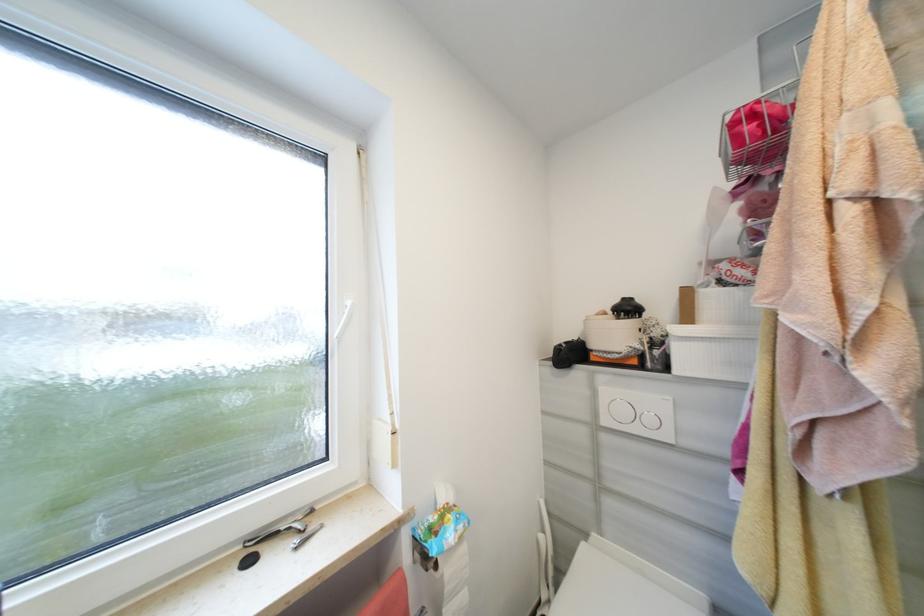
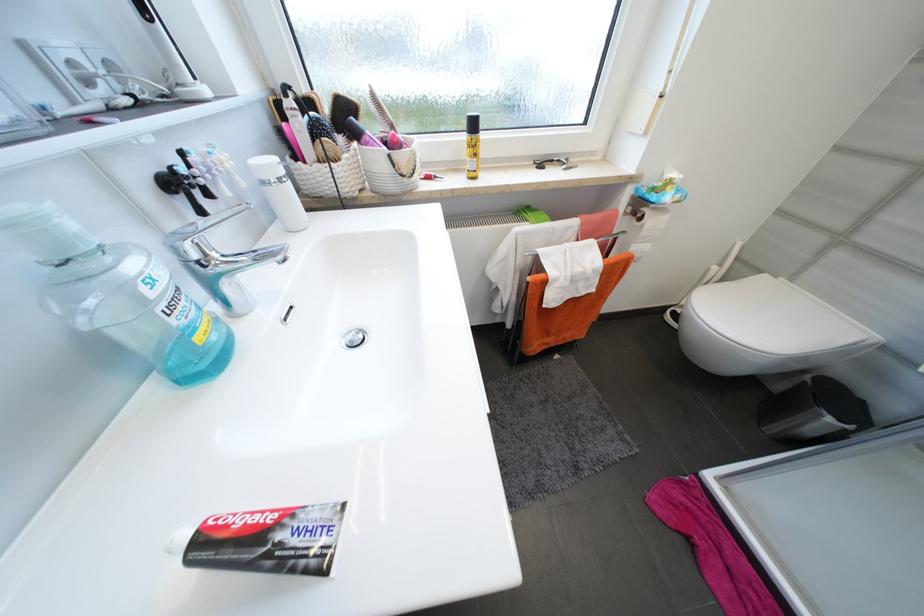
How did the camera likely rotate?

The camera rotated toward left-down.